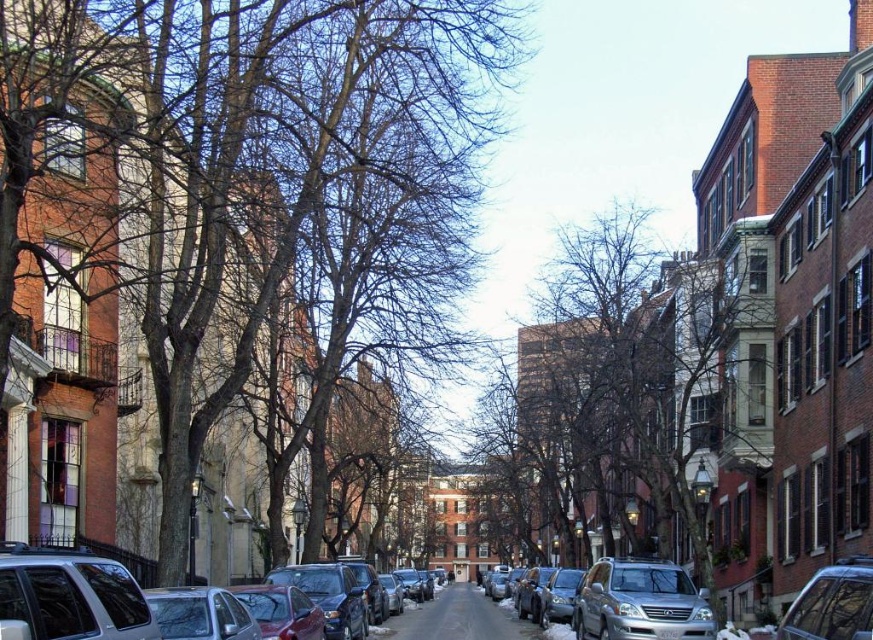
Who is more forward, (265, 253) or (113, 589)?

Point (113, 589)

Can you confirm if brown textured tree at left is shorter than matte silver suv at lower left?

No, brown textured tree at left is not shorter than matte silver suv at lower left.

Is point (176, 294) closer to viewer compared to point (97, 602)?

That is False.

What are the coordinates of `brown textured tree at left` in the screenshot? It's located at (301, 192).

Can you confirm if brown textured tree at left is smaller than metallic silver car at lower right?

Incorrect, brown textured tree at left is not smaller in size than metallic silver car at lower right.

Which is in front, point (424, 220) or point (823, 576)?

Point (823, 576) is in front.

Which is behind, point (238, 22) or point (860, 616)?

Positioned behind is point (238, 22).

Where is `brown textured tree at left`? Image resolution: width=873 pixels, height=640 pixels. brown textured tree at left is located at coordinates (301, 192).

Can you confirm if smooth brown tree at center is shorter than matte silver suv at lower left?

No, smooth brown tree at center is not shorter than matte silver suv at lower left.

Does point (592, 422) lie behind point (28, 602)?

Yes, it is behind point (28, 602).

Find the location of `smooth brown tree at center`. smooth brown tree at center is located at coordinates (622, 401).